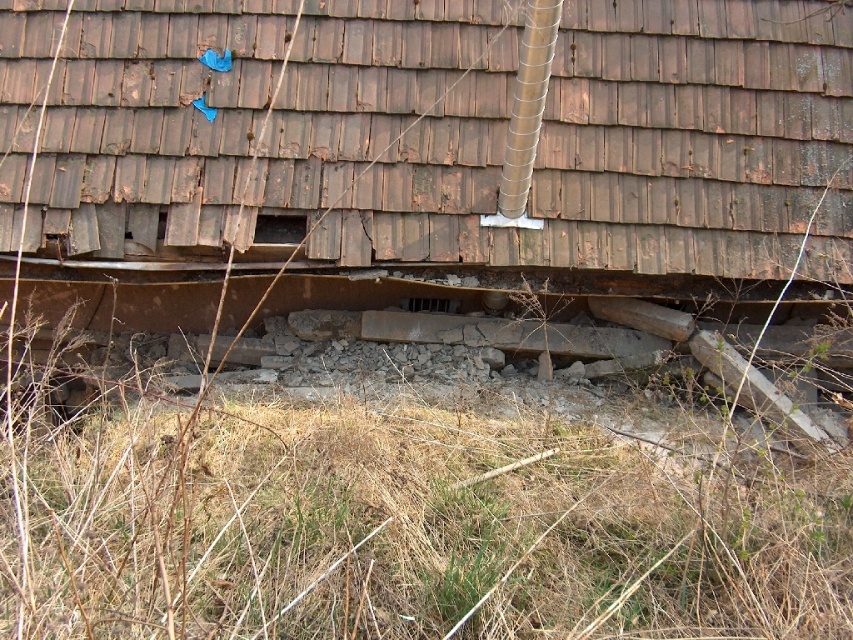
Is point (691, 61) in front of point (88, 529)?

No, it is not.

Does weathered wood shingles at center appear on the right side of brown dry grass at lower center?

Correct, you'll find weathered wood shingles at center to the right of brown dry grass at lower center.

Between point (41, 36) and point (103, 435), which one is positioned in front?

Positioned in front is point (103, 435).

You are a GUI agent. You are given a task and a screenshot of the screen. Output one action in this format:
    pyautogui.click(x=<x>, y=<y>)
    Task: Click on the weathered wood shingles at center
    
    Given the screenshot: What is the action you would take?
    pyautogui.click(x=457, y=132)